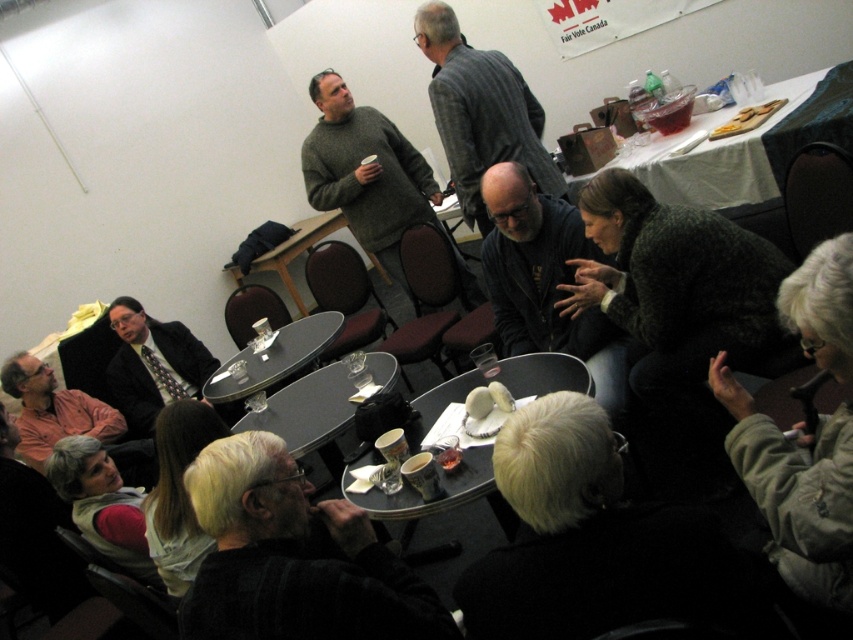
You are a person who is 5 feet tall standing at the edge of the room. You want to grab a drink from the black glossy table at center but need to step over the dark gray sweater at lower center. Can you reach the table without moving the sweater?

The distance between the dark gray sweater at lower center and the black glossy table at center is 38.93 inches. Since you are 5 feet tall, which is 60 inches, you can easily reach over the 38.93 inch gap without needing to move the sweater.